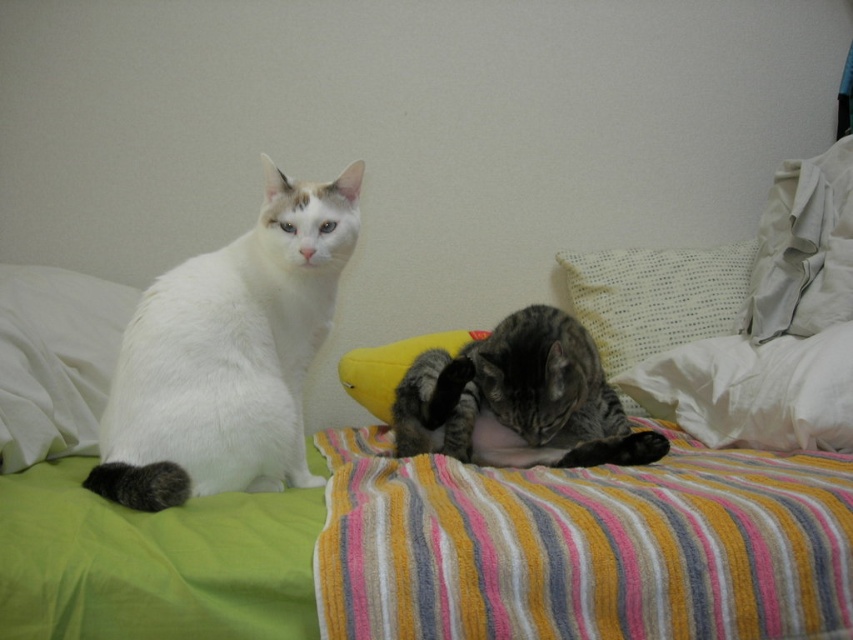
Question: Which object is closer to the camera taking this photo?

Choices:
 (A) white dotted pillow at upper right
 (B) white soft pillow at right
 (C) tabby fur cat at center

Answer: (C)

Question: Is tabby fur cat at center thinner than white soft pillow at right?

Choices:
 (A) no
 (B) yes

Answer: (A)

Question: Which of these objects is positioned closest to the white fluffy cat at left?

Choices:
 (A) tabby fur cat at center
 (B) white soft pillow at right

Answer: (A)

Question: Can you confirm if white fluffy cat at left is wider than white soft pillow at right?

Choices:
 (A) yes
 (B) no

Answer: (A)

Question: Is white fluffy cat at left further to the viewer compared to white dotted pillow at upper right?

Choices:
 (A) no
 (B) yes

Answer: (A)

Question: Which point appears closest to the camera in this image?

Choices:
 (A) (602, 419)
 (B) (601, 321)

Answer: (A)